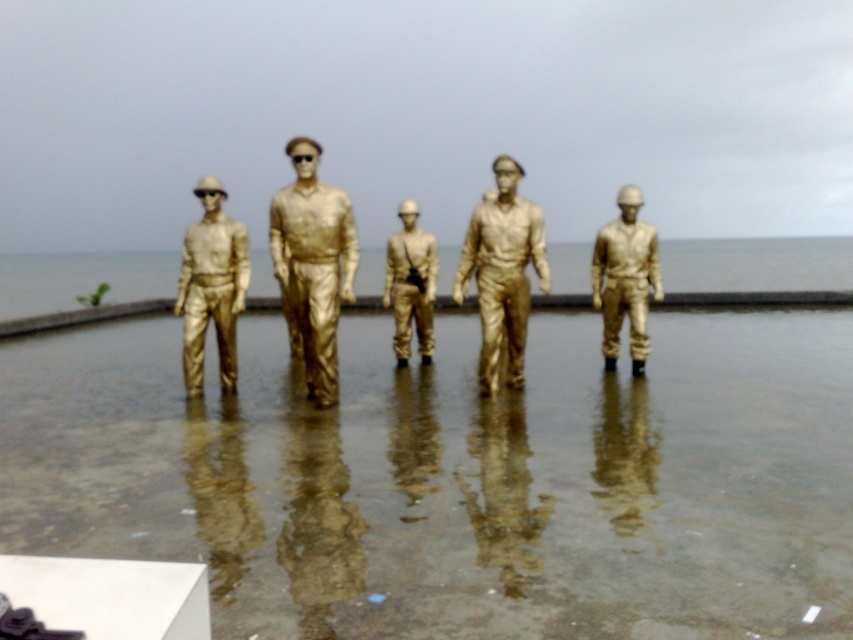
Who is more distant from viewer, (x=187, y=371) or (x=624, y=225)?

Point (x=624, y=225)

Is gold metallic statue at left in front of gold metallic soldier at center?

Yes.

Does point (235, 259) come closer to viewer compared to point (618, 243)?

Yes, it is.

This screenshot has width=853, height=640. In order to click on gold metallic statue at left in this screenshot , I will do `click(212, 285)`.

Does shiny gold statue at center have a greater width compared to gold metallic figure at center?

Indeed, shiny gold statue at center has a greater width compared to gold metallic figure at center.

The image size is (853, 640). I want to click on shiny gold statue at center, so click(312, 262).

Describe the element at coordinates (625, 278) in the screenshot. I see `gold metallic soldier at center` at that location.

You are a GUI agent. You are given a task and a screenshot of the screen. Output one action in this format:
    pyautogui.click(x=<x>, y=<y>)
    Task: Click on the gold metallic soldier at center
    The width and height of the screenshot is (853, 640).
    Given the screenshot: What is the action you would take?
    pyautogui.click(x=625, y=278)